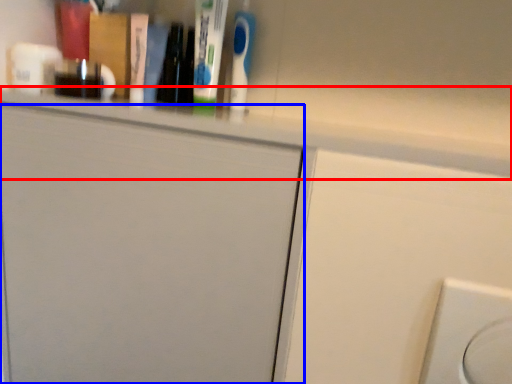
Question: Which object is further to the camera taking this photo, ledge (highlighted by a red box) or door (highlighted by a blue box)?

Choices:
 (A) ledge
 (B) door

Answer: (B)